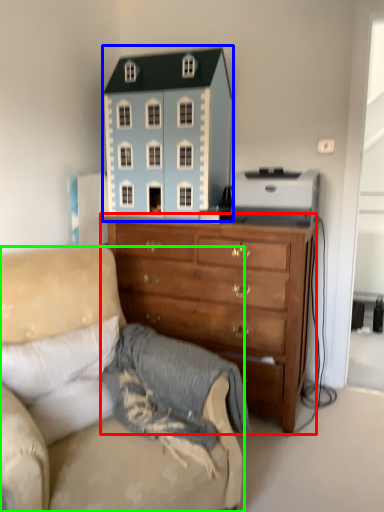
Question: Which object is positioned farthest from chest of drawers (highlighted by a red box)? Select from toy (highlighted by a blue box) and studio couch (highlighted by a green box).

Choices:
 (A) toy
 (B) studio couch

Answer: (B)